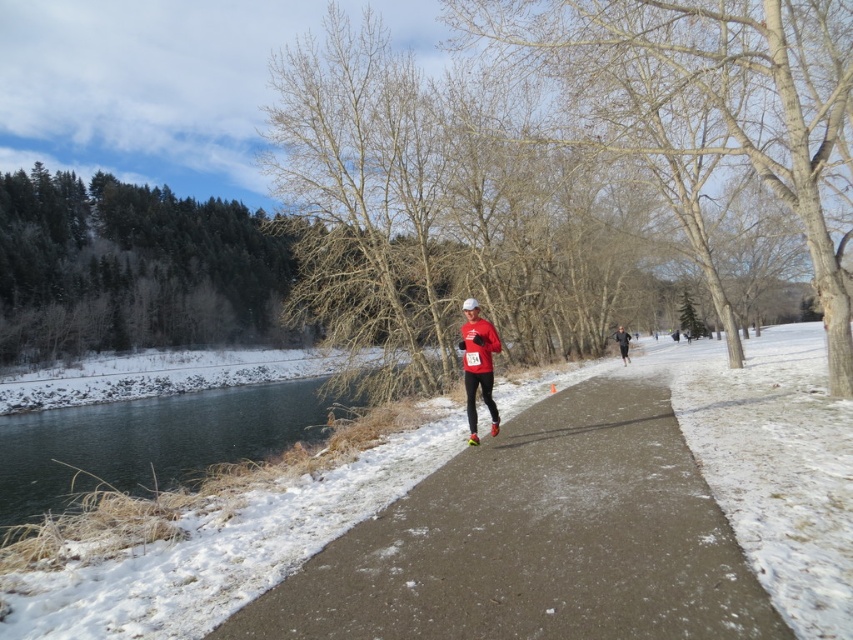
Question: Which object is positioned closest to the black running suit at center?

Choices:
 (A) greenish-blue water at lower left
 (B) green matte trees at upper left

Answer: (A)

Question: Estimate the real-world distances between objects in this image. Which object is farther from the bare wood tree at center?

Choices:
 (A) green matte trees at upper left
 (B) black running suit at center
 (C) matte red running suit at center
 (D) greenish-blue water at lower left

Answer: (A)

Question: Can you confirm if matte red running suit at center is positioned to the left of black running suit at center?

Choices:
 (A) yes
 (B) no

Answer: (A)

Question: Can you confirm if smooth asphalt path at center is wider than matte red running suit at center?

Choices:
 (A) yes
 (B) no

Answer: (A)

Question: Can you confirm if greenish-blue water at lower left is bigger than black running suit at center?

Choices:
 (A) yes
 (B) no

Answer: (A)

Question: Among these objects, which one is farthest from the camera?

Choices:
 (A) smooth asphalt path at center
 (B) black running suit at center
 (C) bare wood tree at center
 (D) matte red running suit at center

Answer: (B)